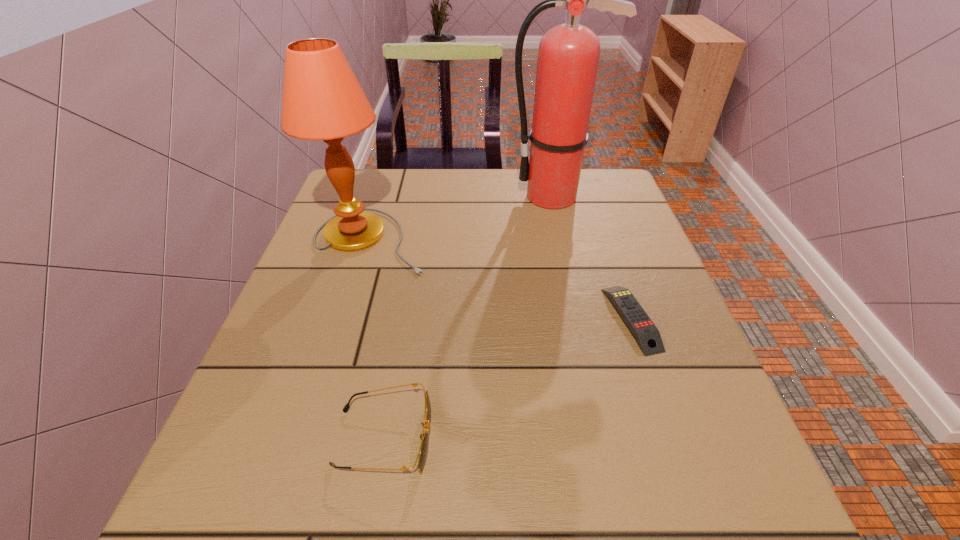
Locate an element on the screen. Image resolution: width=960 pixels, height=540 pixels. the tallest object is located at coordinates (568, 55).

The image size is (960, 540). In order to click on lamp in this screenshot , I will do `click(322, 100)`.

You are a GUI agent. You are given a task and a screenshot of the screen. Output one action in this format:
    pyautogui.click(x=<x>, y=<y>)
    Task: Click on the nearest object
    The height and width of the screenshot is (540, 960).
    Given the screenshot: What is the action you would take?
    pyautogui.click(x=422, y=453)

This screenshot has height=540, width=960. I want to click on the second shortest object, so click(422, 453).

This screenshot has height=540, width=960. Find the location of `the second nearest object`. the second nearest object is located at coordinates (647, 335).

I want to click on remote control, so click(647, 335).

The width and height of the screenshot is (960, 540). In order to click on vacant space situated on the hose direction of the tallest object in this screenshot , I will do `click(482, 197)`.

Locate an element on the screen. vacant area situated 0.090m on the hose direction of the tallest object is located at coordinates (474, 197).

Locate an element on the screen. This screenshot has width=960, height=540. free location located on the hose direction of the tallest object is located at coordinates (444, 197).

Image resolution: width=960 pixels, height=540 pixels. What are the coordinates of `free point located 0.150m on the back of the third shortest object` in the screenshot? It's located at (389, 180).